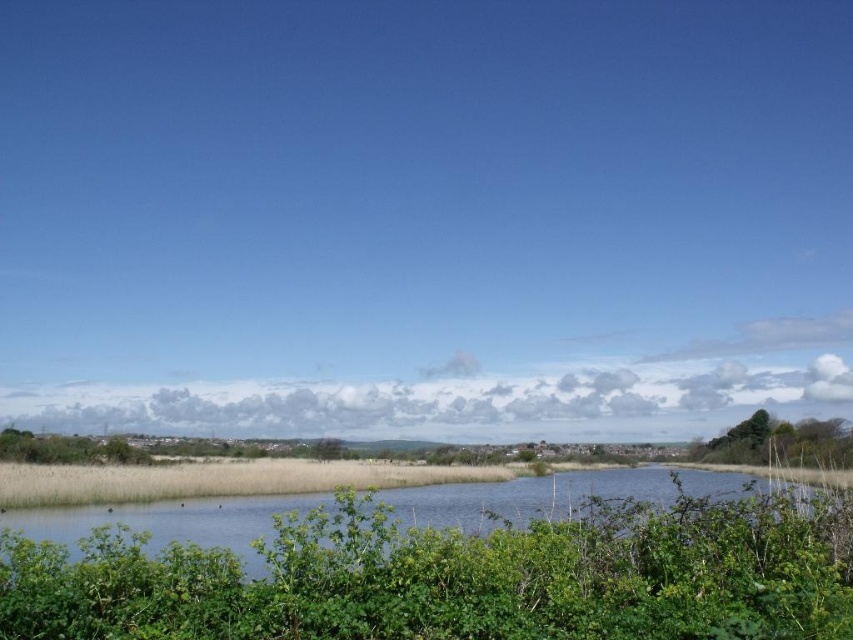
Is green grassy river at center to the right of green leafy bush at right from the viewer's perspective?

No, green grassy river at center is not to the right of green leafy bush at right.

Between green grassy river at center and green leafy bush at right, which one has more height?

green grassy river at center

At what (x,y) coordinates should I click in order to perform the action: click on green grassy river at center. Please return your answer as a coordinate pair (x, y). The width and height of the screenshot is (853, 640). Looking at the image, I should click on (560, 496).

Find the location of `green grassy river at center`. green grassy river at center is located at coordinates (560, 496).